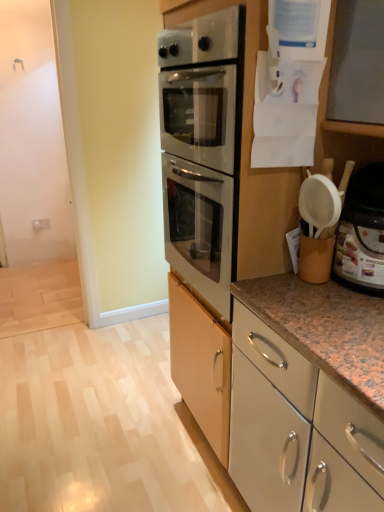
Question: Is white plastic container at right smaller than white glossy cabinet at lower right, the 1th cabinetry in the bottom-to-top sequence?

Choices:
 (A) yes
 (B) no

Answer: (A)

Question: Considering the relative sizes of white plastic container at right and white glossy cabinet at lower right, the 1th cabinetry in the bottom-to-top sequence, in the image provided, is white plastic container at right shorter than white glossy cabinet at lower right, the 1th cabinetry in the bottom-to-top sequence,?

Choices:
 (A) no
 (B) yes

Answer: (A)

Question: Is white plastic container at right in contact with white glossy cabinet at lower right, the 1th cabinetry in the bottom-to-top sequence?

Choices:
 (A) no
 (B) yes

Answer: (A)

Question: Considering the relative sizes of white plastic container at right and white glossy cabinet at lower right, the 1th cabinetry in the bottom-to-top sequence, in the image provided, is white plastic container at right taller than white glossy cabinet at lower right, the 1th cabinetry in the bottom-to-top sequence,?

Choices:
 (A) yes
 (B) no

Answer: (A)

Question: Is white plastic container at right facing away from white glossy cabinet at lower right, the 1th cabinetry in the bottom-to-top sequence?

Choices:
 (A) yes
 (B) no

Answer: (B)

Question: Is point (354, 498) positioned closer to the camera than point (382, 282)?

Choices:
 (A) farther
 (B) closer

Answer: (B)

Question: Considering the relative positions of white glossy cabinet at lower right, arranged as the 2th cabinetry when viewed from the top, and white plastic container at right in the image provided, is white glossy cabinet at lower right, arranged as the 2th cabinetry when viewed from the top, to the left or to the right of white plastic container at right?

Choices:
 (A) right
 (B) left

Answer: (B)

Question: From a real-world perspective, is white glossy cabinet at lower right, arranged as the 2th cabinetry when viewed from the top, physically located above or below white plastic container at right?

Choices:
 (A) above
 (B) below

Answer: (B)

Question: From the image's perspective, relative to white plastic container at right, is white glossy cabinet at lower right, the 1th cabinetry in the bottom-to-top sequence, above or below?

Choices:
 (A) above
 (B) below

Answer: (B)

Question: From the image's perspective, is white glossy cabinet at lower right, arranged as the 2th cabinetry when viewed from the top, positioned above or below white glossy cabinet at center, which is counted as the second cabinetry, starting from the bottom?

Choices:
 (A) below
 (B) above

Answer: (A)

Question: Is point (278, 429) positioned closer to the camera than point (316, 495)?

Choices:
 (A) closer
 (B) farther

Answer: (B)

Question: Is white glossy cabinet at lower right, arranged as the 2th cabinetry when viewed from the top, bigger or smaller than white glossy cabinet at center, which is counted as the second cabinetry, starting from the bottom?

Choices:
 (A) big
 (B) small

Answer: (B)

Question: Relative to white glossy cabinet at center, which is counted as the second cabinetry, starting from the bottom, is white glossy cabinet at lower right, arranged as the 2th cabinetry when viewed from the top, in front or behind?

Choices:
 (A) front
 (B) behind

Answer: (B)

Question: Is white plastic container at right in front of or behind white glossy cabinet at lower right, arranged as the 2th cabinetry when viewed from the top, in the image?

Choices:
 (A) behind
 (B) front

Answer: (B)

Question: Considering the positions of point (369, 287) and point (327, 394), is point (369, 287) closer or farther from the camera than point (327, 394)?

Choices:
 (A) closer
 (B) farther

Answer: (B)